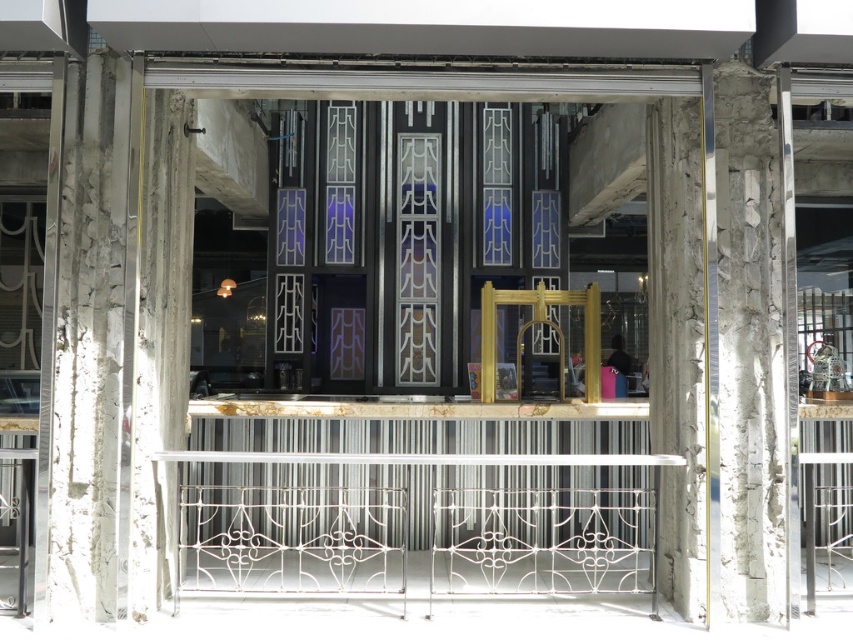
Question: Is black glass door at center closer to camera compared to white wrought iron fence at center?

Choices:
 (A) yes
 (B) no

Answer: (B)

Question: Does black glass door at center have a smaller size compared to white wrought iron fence at center?

Choices:
 (A) no
 (B) yes

Answer: (B)

Question: Is black glass door at center to the right of white wrought iron fence at center from the viewer's perspective?

Choices:
 (A) yes
 (B) no

Answer: (A)

Question: Which object appears closest to the camera in this image?

Choices:
 (A) white wrought iron fence at center
 (B) black glass door at center

Answer: (A)